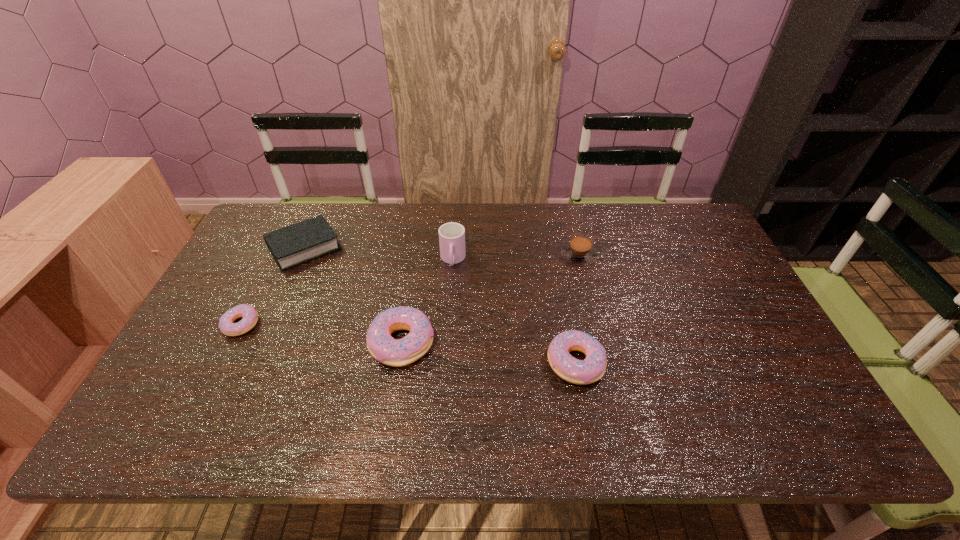
Image resolution: width=960 pixels, height=540 pixels. I want to click on vacant space located 0.370m on the front of the Bible, so click(x=248, y=376).

At what (x,y) coordinates should I click in order to perform the action: click on free space located with the handle on the side of the cup. Please return your answer as a coordinate pair (x, y). Looking at the image, I should click on (449, 310).

Identify the location of vacant space located on the front of the cappuccino. click(x=608, y=373).

Locate an element on the screen. The image size is (960, 540). Bible at the far edge is located at coordinates pos(295,244).

Identify the location of cappuccino situated at the far edge. (579, 250).

At what (x,y) coordinates should I click in order to perform the action: click on object present at the near edge. Please return your answer as a coordinate pair (x, y). Image resolution: width=960 pixels, height=540 pixels. Looking at the image, I should click on (591, 369).

Where is `doughnut present at the left edge`? doughnut present at the left edge is located at coordinates click(250, 316).

Where is `Bible located at the left edge`? Bible located at the left edge is located at coordinates (295, 244).

You are a GUI agent. You are given a task and a screenshot of the screen. Output one action in this format:
    pyautogui.click(x=<x>, y=<y>)
    Task: Click on the object present at the far left corner
    This screenshot has width=960, height=540.
    Given the screenshot: What is the action you would take?
    pyautogui.click(x=295, y=244)

Identify the location of vacant region at the far edge. Image resolution: width=960 pixels, height=540 pixels. (550, 207).